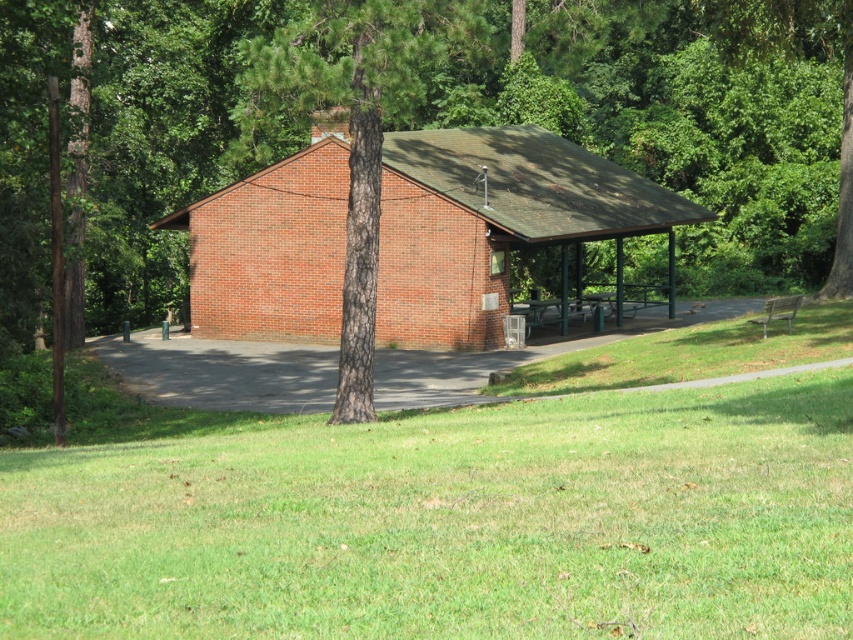
Between point (646, 378) and point (453, 22), which one is positioned in front?

Point (453, 22) is in front.

Who is more distant from viewer, (430, 490) or (351, 401)?

Positioned behind is point (351, 401).

Locate an element on the screen. This screenshot has height=640, width=853. green grass at center is located at coordinates (445, 520).

What do you see at coordinates (445, 520) in the screenshot?
I see `green grass at center` at bounding box center [445, 520].

Consider the image. Does green grass at center have a lesser height compared to green metal picnic table at center?

No.

Who is more distant from viewer, [221,538] or [595,314]?

Point [595,314]

Where is `green grass at center`? green grass at center is located at coordinates (445, 520).

Between smooth bark tree at center and green metal picnic table at center, which one is positioned lower?

green metal picnic table at center is below.

Which is behind, point (103, 276) or point (554, 307)?

The point (103, 276) is more distant.

Is point (672, 92) in front of point (520, 301)?

No, (672, 92) is behind (520, 301).

Locate an element on the screen. Image resolution: width=853 pixels, height=640 pixels. smooth bark tree at center is located at coordinates (669, 113).